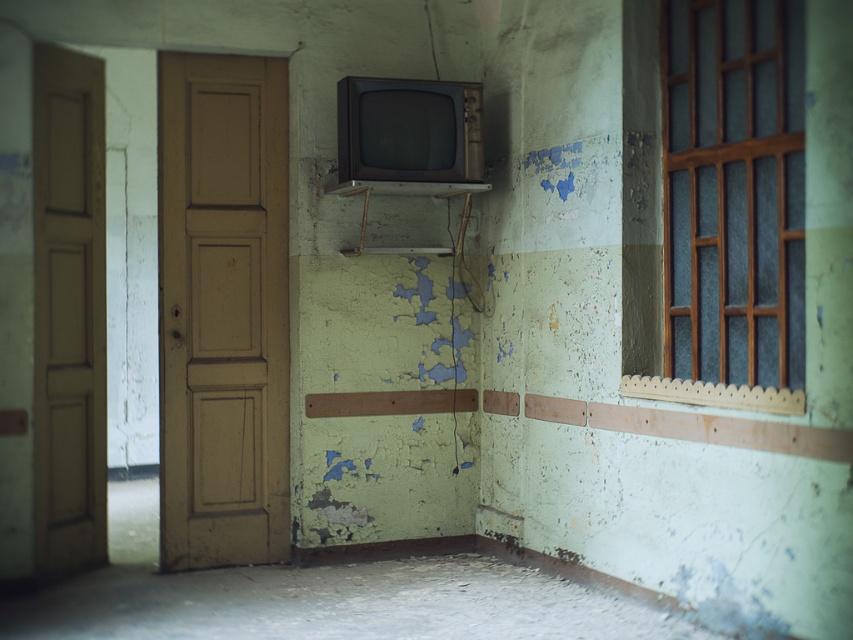
Between brown matte door at left and brown wooden door at left, which one is positioned higher?

Positioned higher is brown matte door at left.

Does point (216, 365) lie behind point (59, 560)?

Yes.

Between point (247, 563) and point (44, 102), which one is positioned behind?

Point (247, 563)

You are a GUI agent. You are given a task and a screenshot of the screen. Output one action in this format:
    pyautogui.click(x=<x>, y=<y>)
    Task: Click on the brown matte door at left
    
    Given the screenshot: What is the action you would take?
    pyautogui.click(x=222, y=310)

Can you confirm if brown wooden door at left is thinner than peeling paint crack at center?

In fact, brown wooden door at left might be wider than peeling paint crack at center.

Between point (39, 292) and point (451, 342), which one is positioned in front?

Point (39, 292) is more forward.

Is point (41, 170) in front of point (456, 440)?

Yes, point (41, 170) is closer to viewer.

You are a GUI agent. You are given a task and a screenshot of the screen. Output one action in this format:
    pyautogui.click(x=<x>, y=<y>)
    Task: Click on the brown wooden door at left
    
    Given the screenshot: What is the action you would take?
    pyautogui.click(x=68, y=310)

Which is above, brown matte door at left or wooden-framed glass at upper right?

wooden-framed glass at upper right is higher up.

Is brown matte door at left above wooden-framed glass at upper right?

Incorrect, brown matte door at left is not positioned above wooden-framed glass at upper right.

Find the location of `brown matte door at left`. brown matte door at left is located at coordinates (222, 310).